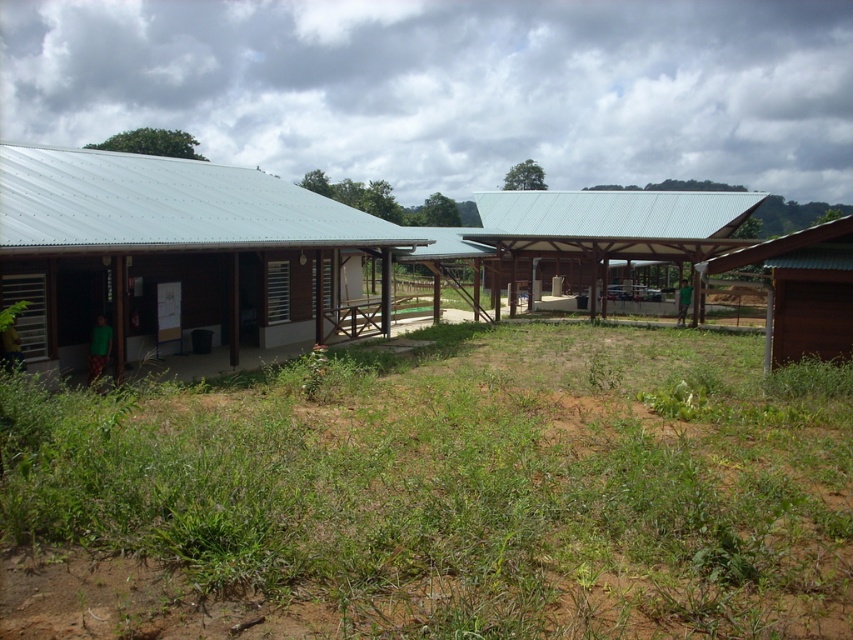
Describe the element at coordinates (170, 252) in the screenshot. The height and width of the screenshot is (640, 853). I see `metallic corrugated roof at left` at that location.

Is metallic corrugated roof at left above brown wooden barn at right?

Indeed, metallic corrugated roof at left is positioned over brown wooden barn at right.

Which is behind, point (178, 205) or point (813, 330)?

Positioned behind is point (178, 205).

Where is `metallic corrugated roof at left`? The height and width of the screenshot is (640, 853). metallic corrugated roof at left is located at coordinates (170, 252).

Is green grass at center taller than metallic corrugated roof at left?

No, green grass at center is not taller than metallic corrugated roof at left.

Between green grass at center and metallic corrugated roof at left, which one has more height?

metallic corrugated roof at left

Find the location of `green grass at center`. green grass at center is located at coordinates (x=440, y=493).

Image resolution: width=853 pixels, height=640 pixels. I want to click on green grass at center, so click(440, 493).

What do you see at coordinates (170, 252) in the screenshot? I see `metallic corrugated roof at left` at bounding box center [170, 252].

Who is higher up, metallic corrugated roof at left or metallic roof at center?

metallic roof at center is higher up.

Is point (90, 164) farther from camera compared to point (639, 216)?

No.

You are a GUI agent. You are given a task and a screenshot of the screen. Output one action in this format:
    pyautogui.click(x=<x>, y=<y>)
    Task: Click on the metallic corrugated roof at left
    The width and height of the screenshot is (853, 640).
    Given the screenshot: What is the action you would take?
    pyautogui.click(x=170, y=252)